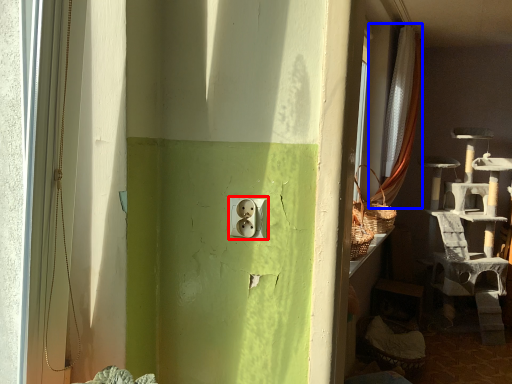
Question: Which object is further to the camera taking this photo, electric outlet (highlighted by a red box) or curtain (highlighted by a blue box)?

Choices:
 (A) electric outlet
 (B) curtain

Answer: (B)